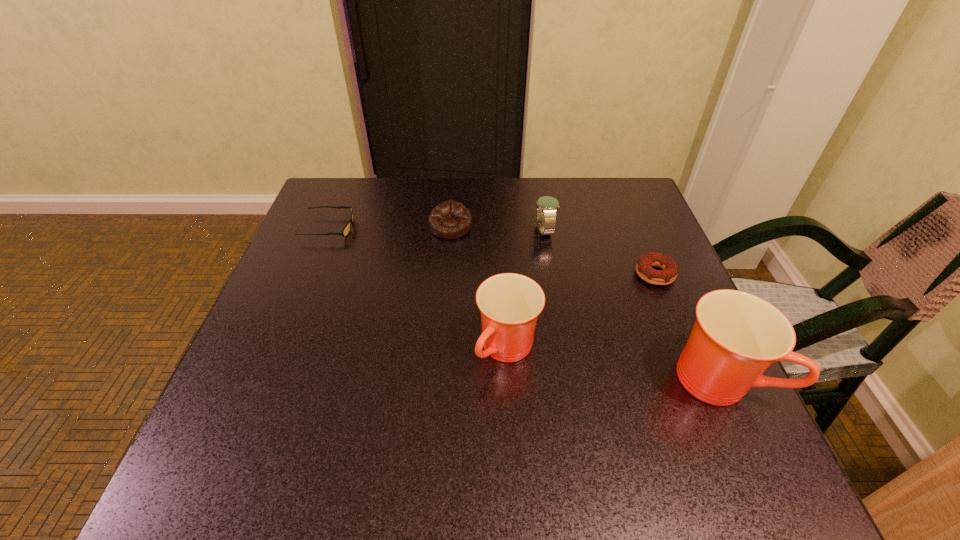
This screenshot has height=540, width=960. I want to click on object located in the left edge section of the desktop, so click(x=347, y=228).

Identify the location of cup at the right edge. (737, 336).

Identify the location of doughnut that is positioned at the right edge. coord(644,269).

Where is `object at the far left corner`? object at the far left corner is located at coordinates (347, 228).

Identify the location of object present at the near right corner. The height and width of the screenshot is (540, 960). (737, 336).

In the image, there is a desktop. Identify the location of vacant space at the far edge. This screenshot has width=960, height=540. (506, 208).

Image resolution: width=960 pixels, height=540 pixels. I want to click on vacant region at the near edge of the desktop, so click(x=500, y=399).

Locate an element on the screen. vacant space at the left edge of the desktop is located at coordinates (302, 263).

Identify the location of free point at the right edge. (656, 299).

Locate an element on the screen. This screenshot has width=960, height=540. vacant space at the far left corner of the desktop is located at coordinates [x=372, y=204].